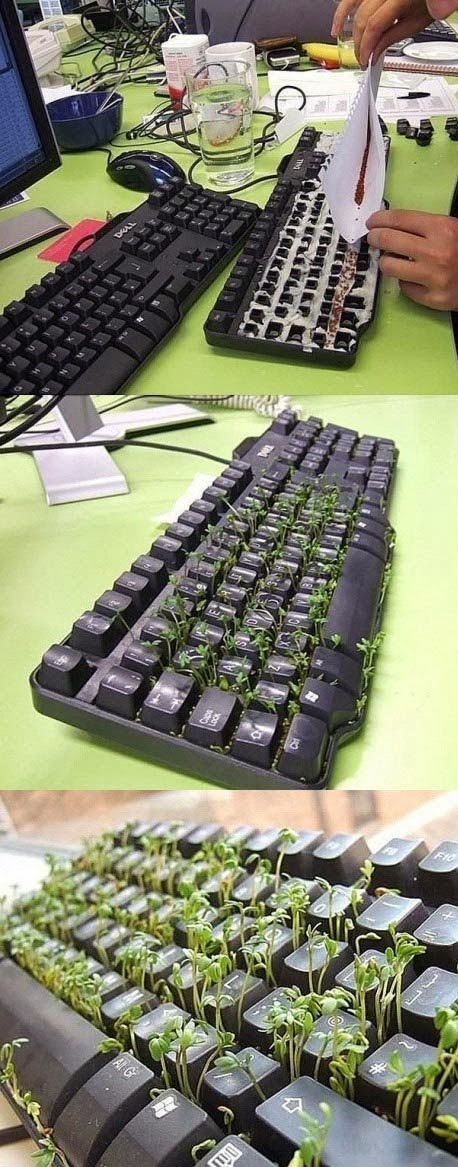
The image size is (458, 1167). What are the coordinates of `monitor` in the screenshot? It's located at (27, 134).